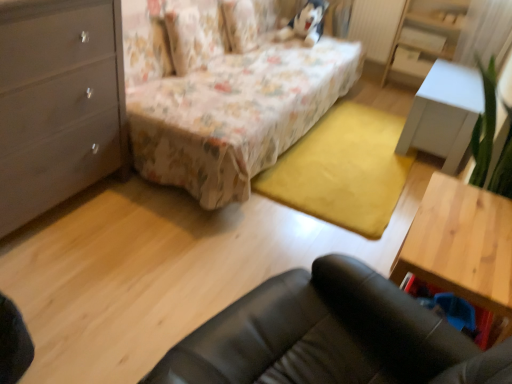
You are a GUI agent. You are given a task and a screenshot of the screen. Output one action in this format:
    pyautogui.click(x=<x>, y=<y>)
    Task: Click on the vacant region above white glossy table at right, marked as the first table in a right-to-left arrangement (from a real-world perspective)
    This screenshot has width=512, height=384.
    Given the screenshot: What is the action you would take?
    click(x=465, y=81)